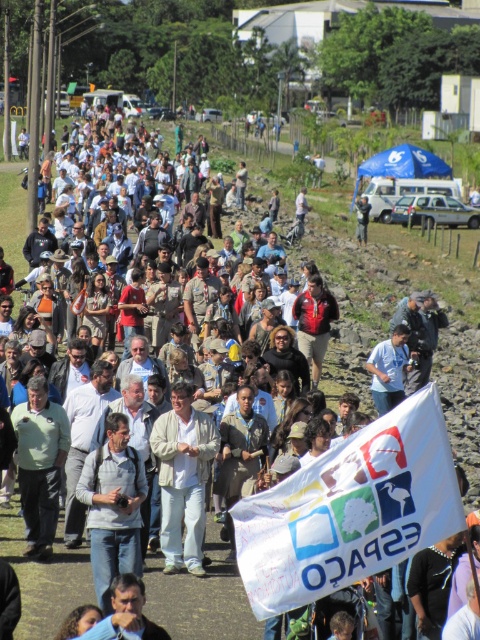
Question: Which object is closer to the camera taking this photo?

Choices:
 (A) white fabric flag at center
 (B) gray fabric shirt at center

Answer: (A)

Question: Based on their relative distances, which object is nearer to the dark blue shirt at center?

Choices:
 (A) white cotton shirt at center
 (B) gray fabric shirt at center
 (C) white fabric flag at center

Answer: (A)

Question: Is white fabric flag at center above dark blue shirt at center?

Choices:
 (A) yes
 (B) no

Answer: (B)

Question: Based on their relative distances, which object is farther from the gray fabric shirt at center?

Choices:
 (A) dark blue shirt at center
 (B) white fabric flag at center
 (C) white cotton shirt at center

Answer: (A)

Question: Is gray fabric shirt at center closer to the viewer compared to dark blue shirt at center?

Choices:
 (A) no
 (B) yes

Answer: (B)

Question: Is white cotton shirt at center wider than gray fabric shirt at center?

Choices:
 (A) yes
 (B) no

Answer: (A)